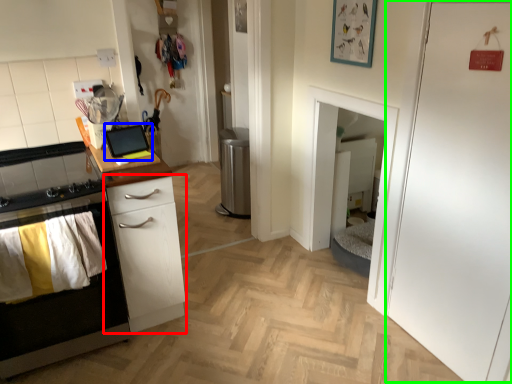
Question: Based on their relative distances, which object is nearer to chest of drawers (highlighted by a red box)? Choose from appliance (highlighted by a blue box) and door (highlighted by a green box).

Choices:
 (A) appliance
 (B) door

Answer: (A)